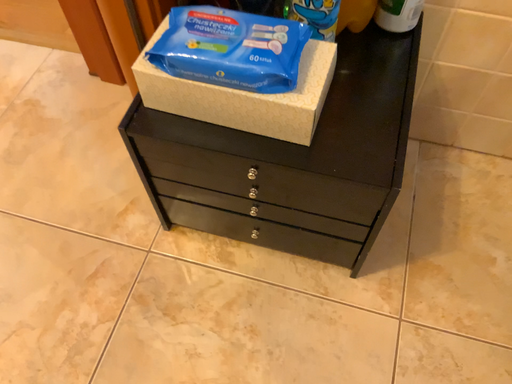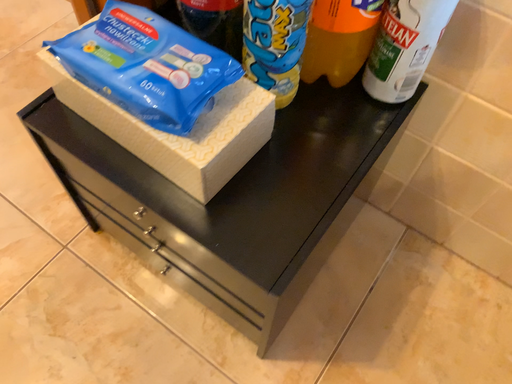
Question: How did the camera likely rotate when shooting the video?

Choices:
 (A) rotated right
 (B) rotated left

Answer: (B)